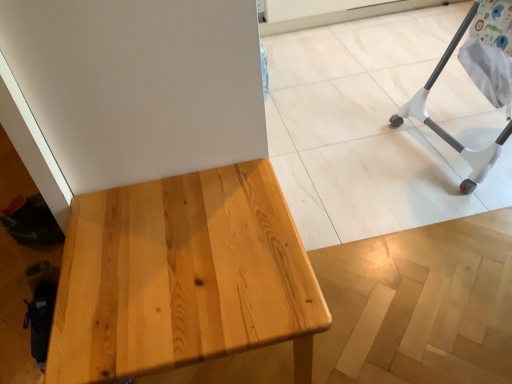
Question: Is natural wood table at center in front of or behind white plastic baby bouncer at right in the image?

Choices:
 (A) front
 (B) behind

Answer: (A)

Question: Looking at the image, does natural wood table at center seem bigger or smaller compared to white plastic baby bouncer at right?

Choices:
 (A) big
 (B) small

Answer: (B)

Question: Is natural wood table at center spatially inside white plastic baby bouncer at right, or outside of it?

Choices:
 (A) outside
 (B) inside

Answer: (A)

Question: Considering the positions of white plastic baby bouncer at right and natural wood table at center in the image, is white plastic baby bouncer at right taller or shorter than natural wood table at center?

Choices:
 (A) tall
 (B) short

Answer: (A)

Question: In terms of size, does white plastic baby bouncer at right appear bigger or smaller than natural wood table at center?

Choices:
 (A) big
 (B) small

Answer: (A)

Question: Does point (453, 43) appear closer or farther from the camera than point (273, 188)?

Choices:
 (A) closer
 (B) farther

Answer: (B)

Question: Considering their positions, is white plastic baby bouncer at right located in front of or behind natural wood table at center?

Choices:
 (A) front
 (B) behind

Answer: (B)